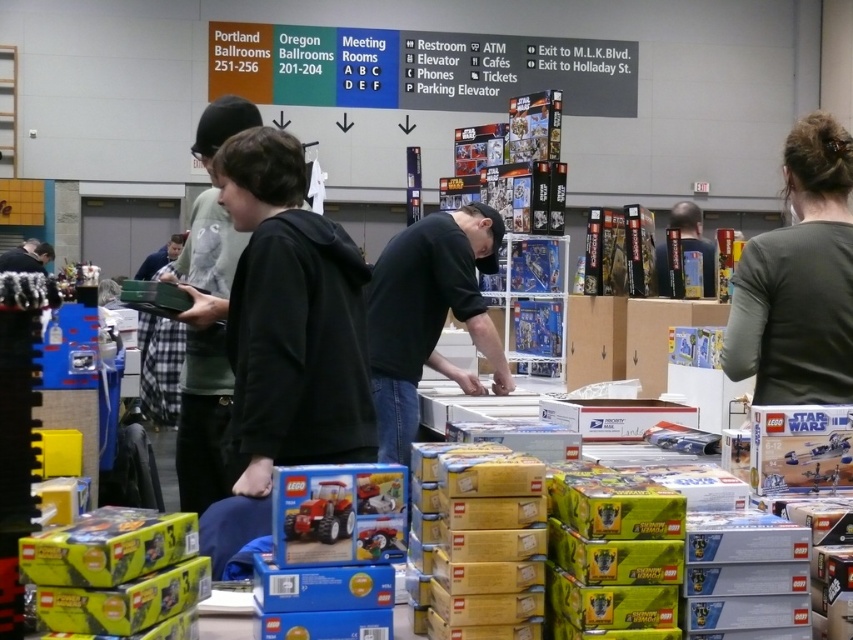
Question: Which of the following is the closest to the observer?

Choices:
 (A) (312, 532)
 (B) (665, 292)
 (C) (26, 252)

Answer: (A)

Question: Does dark gray long-sleeve shirt at upper right appear on the right side of dark green hoodie at center?

Choices:
 (A) yes
 (B) no

Answer: (A)

Question: Based on their relative distances, which object is nearer to the dark gray long-sleeve shirt at upper right?

Choices:
 (A) matte black figure at center
 (B) dark green hoodie at center
 (C) matte red tractor at center

Answer: (C)

Question: Can you confirm if black matte shirt at center is smaller than matte red tractor at center?

Choices:
 (A) yes
 (B) no

Answer: (B)

Question: Which of the following is the farthest from the observer?

Choices:
 (A) (39, 250)
 (B) (322, 483)
 (C) (735, 288)
 (D) (202, 145)

Answer: (A)

Question: Is matte red tractor at center further to the viewer compared to matte black figure at center?

Choices:
 (A) yes
 (B) no

Answer: (B)